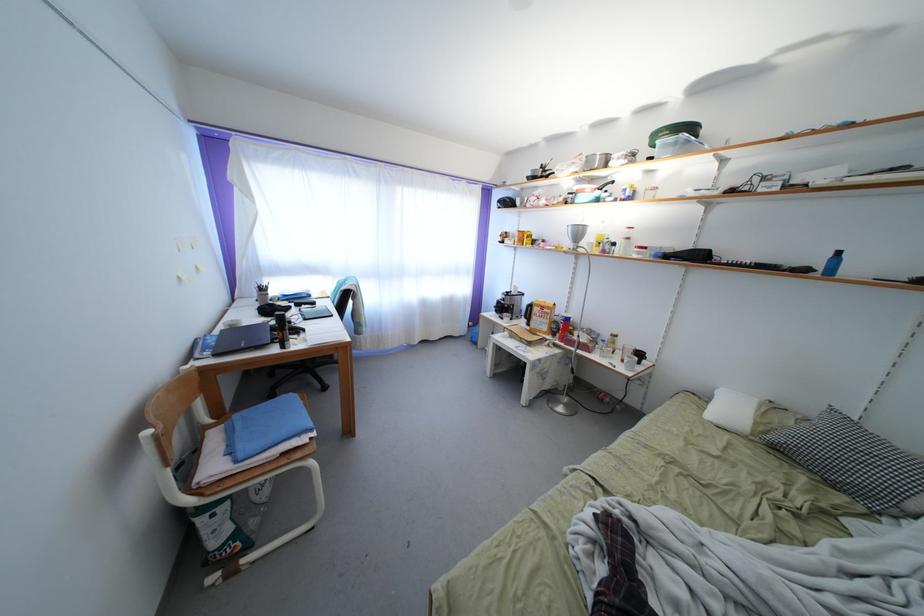
This screenshot has width=924, height=616. What do you see at coordinates (541, 315) in the screenshot?
I see `the yellow cereal box` at bounding box center [541, 315].